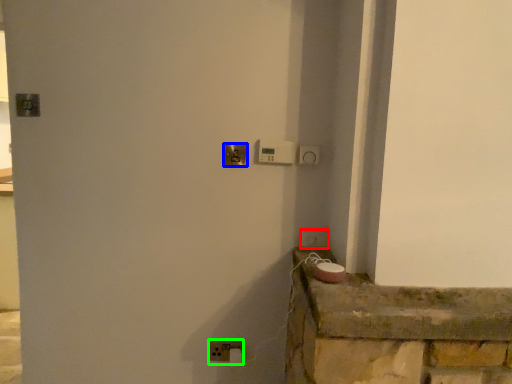
Question: Estimate the real-world distances between objects in this image. Which object is closer to light switch (highlighted by a red box), door handle (highlighted by a blue box) or light switch (highlighted by a green box)?

Choices:
 (A) door handle
 (B) light switch

Answer: (A)